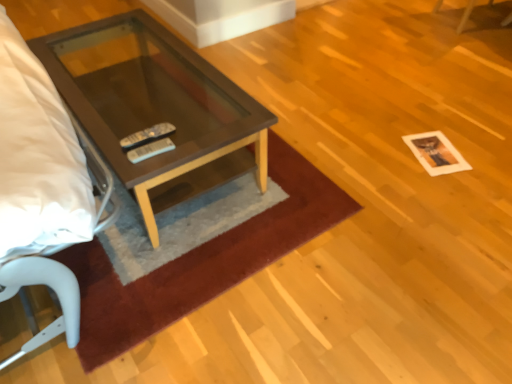
At what (x,y) coordinates should I click in order to perform the action: click on unoccupied space behind white paper at lower right. Please return your answer as a coordinate pair (x, y). Looking at the image, I should click on pyautogui.click(x=416, y=121).